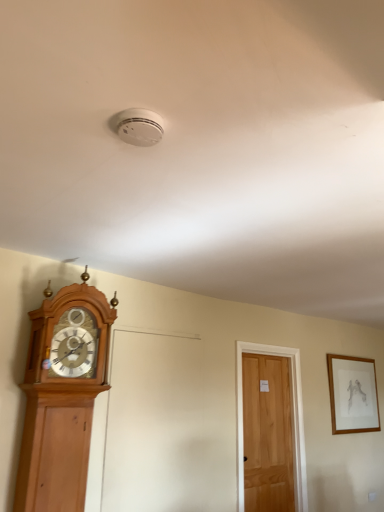
Question: Is light brown wooden door at center-right smaller than wooden framed drawing at upper right?

Choices:
 (A) no
 (B) yes

Answer: (A)

Question: Does light brown wooden door at center-right appear on the right side of wooden framed drawing at upper right?

Choices:
 (A) no
 (B) yes

Answer: (A)

Question: From the image's perspective, is light brown wooden door at center-right under wooden framed drawing at upper right?

Choices:
 (A) no
 (B) yes

Answer: (B)

Question: Does light brown wooden door at center-right appear on the left side of wooden framed drawing at upper right?

Choices:
 (A) yes
 (B) no

Answer: (A)

Question: Is light brown wooden door at center-right outside of wooden framed drawing at upper right?

Choices:
 (A) yes
 (B) no

Answer: (A)

Question: Can you confirm if light brown wooden door at center-right is taller than wooden framed drawing at upper right?

Choices:
 (A) no
 (B) yes

Answer: (B)

Question: Considering the relative sizes of light brown wooden clock at left and light brown wooden door at center-right in the image provided, is light brown wooden clock at left smaller than light brown wooden door at center-right?

Choices:
 (A) yes
 (B) no

Answer: (B)

Question: Considering the relative sizes of light brown wooden clock at left and light brown wooden door at center-right in the image provided, is light brown wooden clock at left wider than light brown wooden door at center-right?

Choices:
 (A) yes
 (B) no

Answer: (A)

Question: Is light brown wooden door at center-right at the back of light brown wooden clock at left?

Choices:
 (A) yes
 (B) no

Answer: (B)

Question: Is light brown wooden clock at left far from light brown wooden door at center-right?

Choices:
 (A) no
 (B) yes

Answer: (B)

Question: Is light brown wooden clock at left thinner than light brown wooden door at center-right?

Choices:
 (A) no
 (B) yes

Answer: (A)

Question: From a real-world perspective, is light brown wooden clock at left on light brown wooden door at center-right?

Choices:
 (A) yes
 (B) no

Answer: (A)

Question: From a real-world perspective, is light brown wooden door at center-right over light brown wooden clock at left?

Choices:
 (A) yes
 (B) no

Answer: (B)